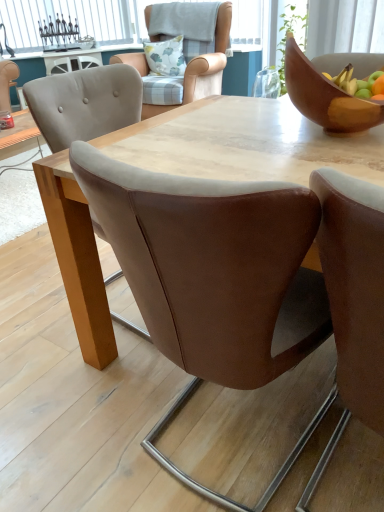
Question: Can you confirm if brown leather chair at center, positioned as the first chair in front-to-back order, is positioned to the left of white glass window at upper left?

Choices:
 (A) yes
 (B) no

Answer: (B)

Question: From the image's perspective, is brown leather chair at center, positioned as the first chair in front-to-back order, beneath white glass window at upper left?

Choices:
 (A) yes
 (B) no

Answer: (A)

Question: From a real-world perspective, does brown leather chair at center, positioned as the first chair in front-to-back order, sit lower than white glass window at upper left?

Choices:
 (A) yes
 (B) no

Answer: (A)

Question: Is brown leather chair at center, the 4th chair in the back-to-front sequence, placed right next to white glass window at upper left?

Choices:
 (A) yes
 (B) no

Answer: (B)

Question: Is brown leather chair at center, the 4th chair in the back-to-front sequence, smaller than white glass window at upper left?

Choices:
 (A) no
 (B) yes

Answer: (A)

Question: From the image's perspective, is brown leather chair at center, which is the third chair in front-to-back order, positioned above or below wooden bowl at upper right?

Choices:
 (A) below
 (B) above

Answer: (A)

Question: Is point (102, 237) closer or farther from the camera than point (306, 73)?

Choices:
 (A) farther
 (B) closer

Answer: (A)

Question: Considering the positions of brown leather chair at center, arranged as the second chair when viewed from the back, and wooden bowl at upper right in the image, is brown leather chair at center, arranged as the second chair when viewed from the back, bigger or smaller than wooden bowl at upper right?

Choices:
 (A) small
 (B) big

Answer: (B)

Question: From a real-world perspective, relative to wooden bowl at upper right, is brown leather chair at center, which is the third chair in front-to-back order, vertically above or below?

Choices:
 (A) below
 (B) above

Answer: (A)

Question: Looking at their shapes, would you say brown leather chair at center, which is the third chair in front-to-back order, is wider or thinner than brown leather chair at center, the 4th chair in the back-to-front sequence?

Choices:
 (A) thin
 (B) wide

Answer: (A)

Question: From a real-world perspective, is brown leather chair at center, arranged as the second chair when viewed from the back, physically located above or below brown leather chair at center, positioned as the first chair in front-to-back order?

Choices:
 (A) above
 (B) below

Answer: (B)

Question: From the image's perspective, is brown leather chair at center, arranged as the second chair when viewed from the back, located above or below brown leather chair at center, the 4th chair in the back-to-front sequence?

Choices:
 (A) above
 (B) below

Answer: (A)

Question: Is brown leather chair at center, which is the third chair in front-to-back order, to the left or to the right of brown leather chair at center, positioned as the first chair in front-to-back order, in the image?

Choices:
 (A) left
 (B) right

Answer: (A)

Question: Looking at the image, does light brown leather chair at upper center, the 1th chair positioned from the back, seem bigger or smaller compared to white glass window at upper left?

Choices:
 (A) big
 (B) small

Answer: (A)

Question: From the image's perspective, is light brown leather chair at upper center, the 1th chair positioned from the back, above or below white glass window at upper left?

Choices:
 (A) above
 (B) below

Answer: (B)